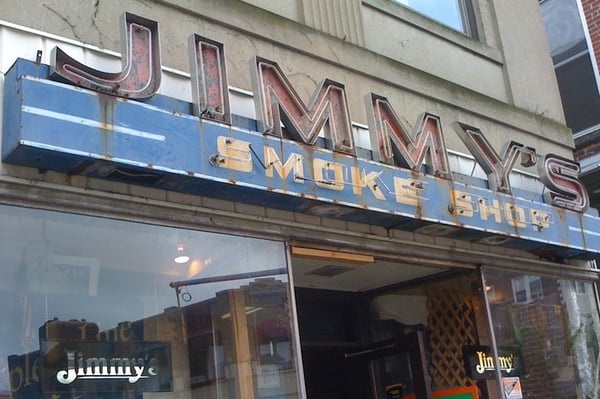
The width and height of the screenshot is (600, 399). I want to click on glass window of store, so click(x=197, y=319).